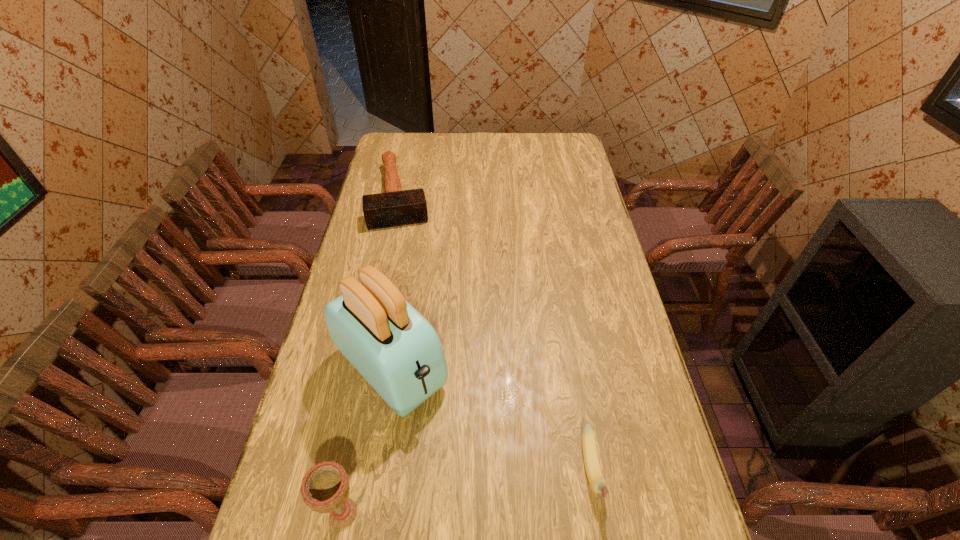
Find the location of a particular element. The image size is (960, 540). free region at the right edge of the desktop is located at coordinates (629, 432).

Find the location of a particular element. Image resolution: width=960 pixels, height=540 pixels. vacant space at the far right corner of the desktop is located at coordinates (545, 150).

Identify the location of vacant area that lies between the banana and the second tallest object. pyautogui.click(x=468, y=492).

The image size is (960, 540). What are the coordinates of `vacant space in between the banana and the toaster` in the screenshot? It's located at (492, 419).

The width and height of the screenshot is (960, 540). Find the location of `vacant space in between the third nearest object and the rightmost object`. vacant space in between the third nearest object and the rightmost object is located at coordinates (492, 419).

The height and width of the screenshot is (540, 960). I want to click on empty space that is in between the banana and the toaster, so click(x=492, y=419).

Image resolution: width=960 pixels, height=540 pixels. I want to click on vacant area that lies between the second tallest object and the banana, so click(x=468, y=492).

The width and height of the screenshot is (960, 540). In order to click on free area in between the toaster and the banana in this screenshot , I will do `click(492, 419)`.

Where is `unoccupied position between the second farthest object and the farthest object`? unoccupied position between the second farthest object and the farthest object is located at coordinates (396, 281).

The width and height of the screenshot is (960, 540). In order to click on vacant point located between the second tallest object and the third nearest object in this screenshot , I will do `click(368, 441)`.